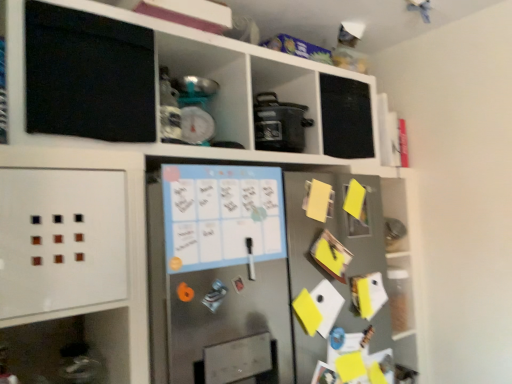
Question: Could you tell me if stainless steel fridge at center is facing yellow paper at right?

Choices:
 (A) yes
 (B) no

Answer: (A)

Question: Is stainless steel fridge at center bigger than yellow paper at right?

Choices:
 (A) no
 (B) yes

Answer: (B)

Question: Does stainless steel fridge at center have a smaller size compared to yellow paper at right?

Choices:
 (A) no
 (B) yes

Answer: (A)

Question: Is stainless steel fridge at center behind yellow paper at right?

Choices:
 (A) yes
 (B) no

Answer: (B)

Question: From the image's perspective, is stainless steel fridge at center below yellow paper at right?

Choices:
 (A) no
 (B) yes

Answer: (B)

Question: Are stainless steel fridge at center and yellow paper at right located far from each other?

Choices:
 (A) no
 (B) yes

Answer: (A)

Question: Is yellow paper at right oriented away from matte black pot at center?

Choices:
 (A) yes
 (B) no

Answer: (B)

Question: Would you say matte black pot at center is part of yellow paper at right's contents?

Choices:
 (A) yes
 (B) no

Answer: (B)

Question: From the image's perspective, is yellow paper at right under matte black pot at center?

Choices:
 (A) no
 (B) yes

Answer: (B)

Question: Is the position of yellow paper at right less distant than that of matte black pot at center?

Choices:
 (A) no
 (B) yes

Answer: (B)

Question: Is yellow paper at right touching matte black pot at center?

Choices:
 (A) yes
 (B) no

Answer: (B)

Question: Does yellow paper at right appear on the right side of matte black pot at center?

Choices:
 (A) no
 (B) yes

Answer: (B)

Question: Is matte black pot at center facing away from yellow paper at right?

Choices:
 (A) yes
 (B) no

Answer: (B)